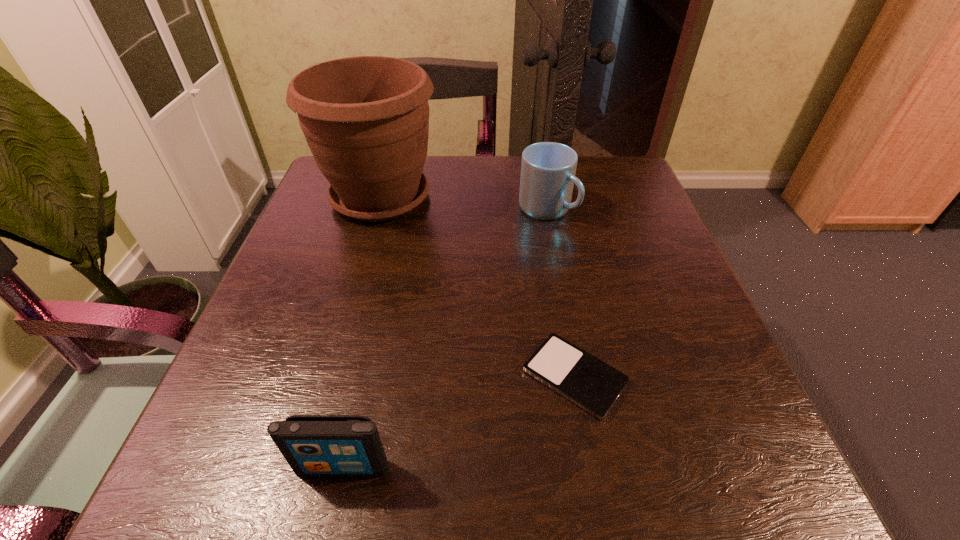
You are a GUI agent. You are given a task and a screenshot of the screen. Output one action in this format:
    pyautogui.click(x=<x>, y=<y>)
    Task: Click on the mug positioned at the far edge
    
    Given the screenshot: What is the action you would take?
    pyautogui.click(x=548, y=169)

This screenshot has width=960, height=540. Find the location of `object located at the near edge`. object located at the near edge is located at coordinates (313, 445).

Locate an element on the screen. This screenshot has width=960, height=540. flowerpot at the left edge is located at coordinates (366, 119).

Identify the location of iPod present at the left edge. This screenshot has width=960, height=540. (313, 445).

Locate an element on the screen. Image resolution: width=960 pixels, height=540 pixels. object that is at the far left corner is located at coordinates (366, 119).

Find the location of a particular element. The width and height of the screenshot is (960, 540). object positioned at the near left corner is located at coordinates (313, 445).

At what (x,y) coordinates should I click in order to perform the action: click on free space at the far edge of the desktop. Please return your answer as a coordinate pair (x, y). The height and width of the screenshot is (540, 960). Looking at the image, I should click on (449, 195).

Find the location of `free spot at the left edge of the desktop`. free spot at the left edge of the desktop is located at coordinates (304, 326).

Where is `vacant space at the right edge of the desktop`? The height and width of the screenshot is (540, 960). vacant space at the right edge of the desktop is located at coordinates (660, 276).

Where is `free region at the far right corner of the desktop`? free region at the far right corner of the desktop is located at coordinates (626, 180).